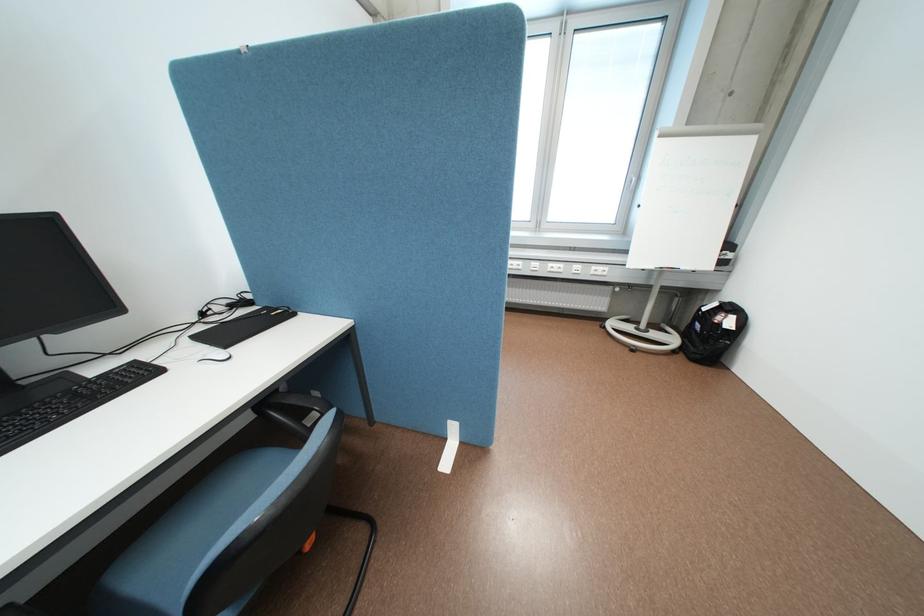
Where is `black backpack`? black backpack is located at coordinates (712, 331).